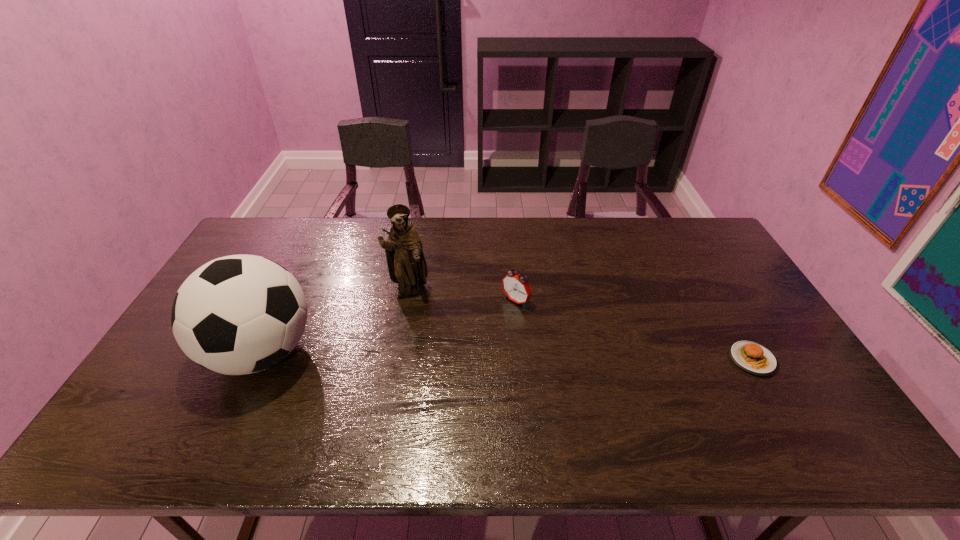
The image size is (960, 540). What are the coordinates of `soccer ball` in the screenshot? It's located at (240, 314).

This screenshot has width=960, height=540. I want to click on food, so (751, 357).

Where is `the shortest object`? This screenshot has width=960, height=540. the shortest object is located at coordinates (751, 357).

Identify the location of the third object from left to right. (516, 288).

Locate an element on the screen. This screenshot has width=960, height=540. the third tallest object is located at coordinates (516, 288).

Locate an element on the screen. figurine is located at coordinates (406, 263).

Where is `free region located on the back of the soccer ball`? The height and width of the screenshot is (540, 960). free region located on the back of the soccer ball is located at coordinates (291, 291).

The width and height of the screenshot is (960, 540). What are the coordinates of `blank space located 0.110m on the back of the food` in the screenshot? It's located at (726, 314).

Image resolution: width=960 pixels, height=540 pixels. I want to click on free spot located on the clock face of the alarm clock, so click(440, 367).

Identify the location of vacant point located on the clock face of the alarm clock. Image resolution: width=960 pixels, height=540 pixels. (450, 358).